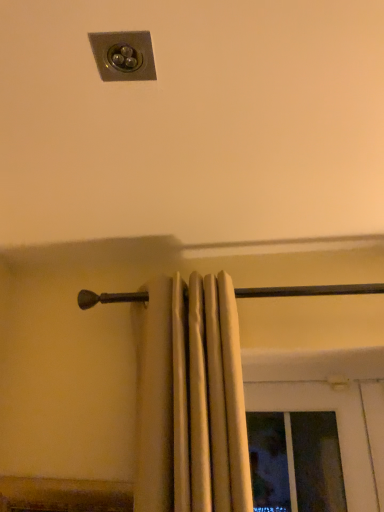
What do you see at coordinates (123, 55) in the screenshot? I see `metallic square socket at upper center` at bounding box center [123, 55].

Find the location of a particular element. This screenshot has width=384, height=512. metallic square socket at upper center is located at coordinates (123, 55).

What is the approximate height of metallic square socket at upper center?

The height of metallic square socket at upper center is 1.22 inches.

This screenshot has width=384, height=512. I want to click on metallic square socket at upper center, so click(x=123, y=55).